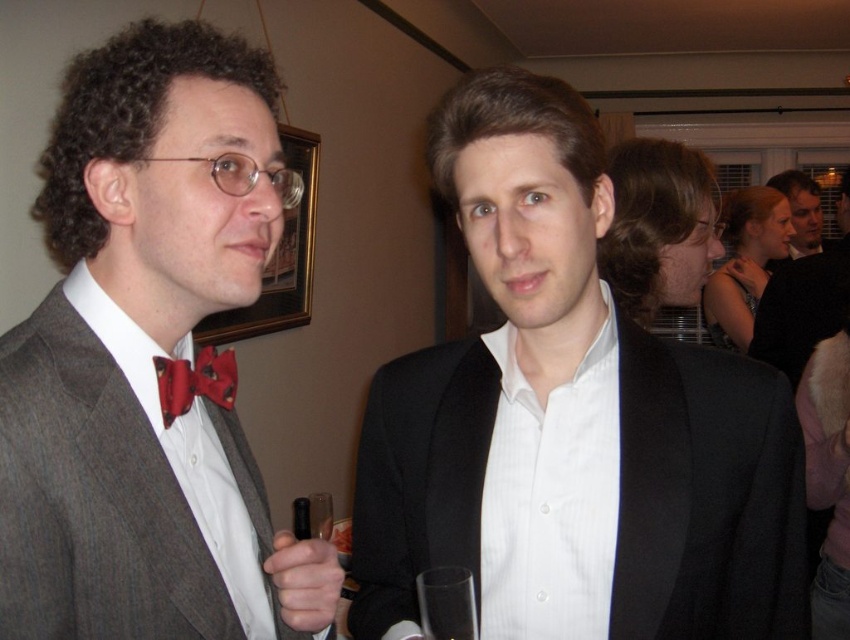
You are at a party and want to grab a drink from the table behind the transparent glass at center without touching the black matte suit at center. Is there enough space between them for you to reach around?

The black matte suit at center is to the right of the transparent glass at center, so there is space between them. You can reach around to grab the drink without touching the suit.

You are a photographer setting up a backdrop for a photo shoot. You need to ensure that the black matte suit at center and the white shirt at center are fully visible in the frame. Based on their sizes, which object might require more space in the frame?

The black matte suit at center might be wider than the white shirt at center, so it might require more space in the frame to ensure it is fully visible.

You are a photographer adjusting your camera settings to focus on the black matte suit at center and the white shirt at center. Which object should you focus on first to ensure proper depth of field?

The black matte suit at center is closer to the viewer than the white shirt at center, so you should focus on the black matte suit at center first to ensure proper depth of field.